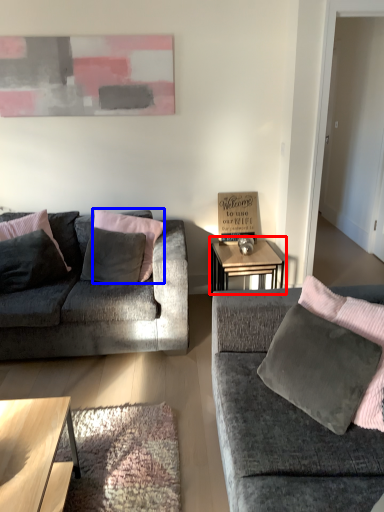
Question: Which object is closer to the camera taking this photo, table (highlighted by a red box) or pillow (highlighted by a blue box)?

Choices:
 (A) table
 (B) pillow

Answer: (B)